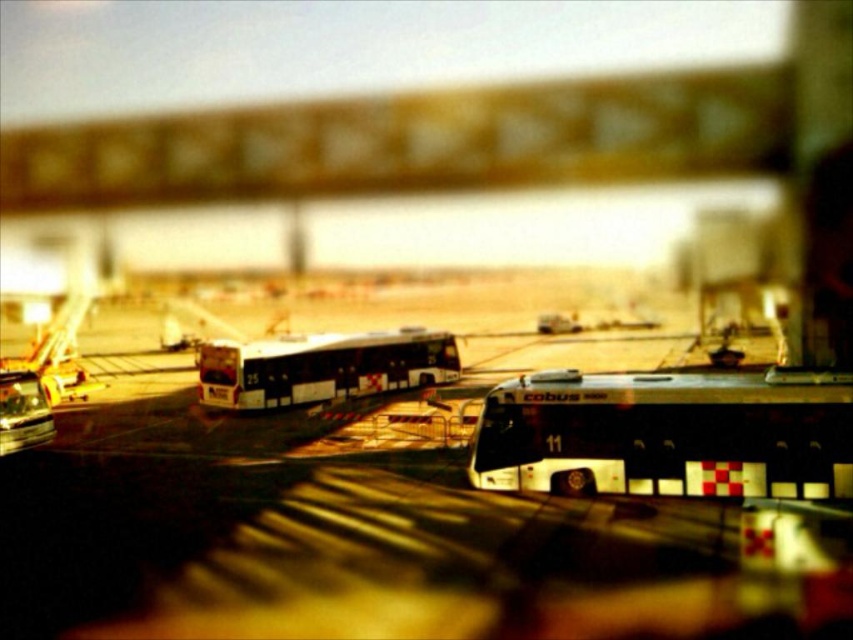
Question: Among these objects, which one is nearest to the camera?

Choices:
 (A) white matte bus at center
 (B) white glossy bus at center

Answer: (A)

Question: Does metallic signboard at upper center appear on the left side of white glossy bus at center?

Choices:
 (A) no
 (B) yes

Answer: (A)

Question: Is metallic signboard at upper center wider than white glossy bus at center?

Choices:
 (A) no
 (B) yes

Answer: (B)

Question: Which object appears farthest from the camera in this image?

Choices:
 (A) white glossy bus at center
 (B) white matte bus at center

Answer: (A)

Question: Estimate the real-world distances between objects in this image. Which object is farther from the metallic signboard at upper center?

Choices:
 (A) white glossy bus at center
 (B) white matte bus at center

Answer: (B)

Question: Considering the relative positions of white matte bus at center and white glossy bus at center in the image provided, where is white matte bus at center located with respect to white glossy bus at center?

Choices:
 (A) right
 (B) left

Answer: (A)